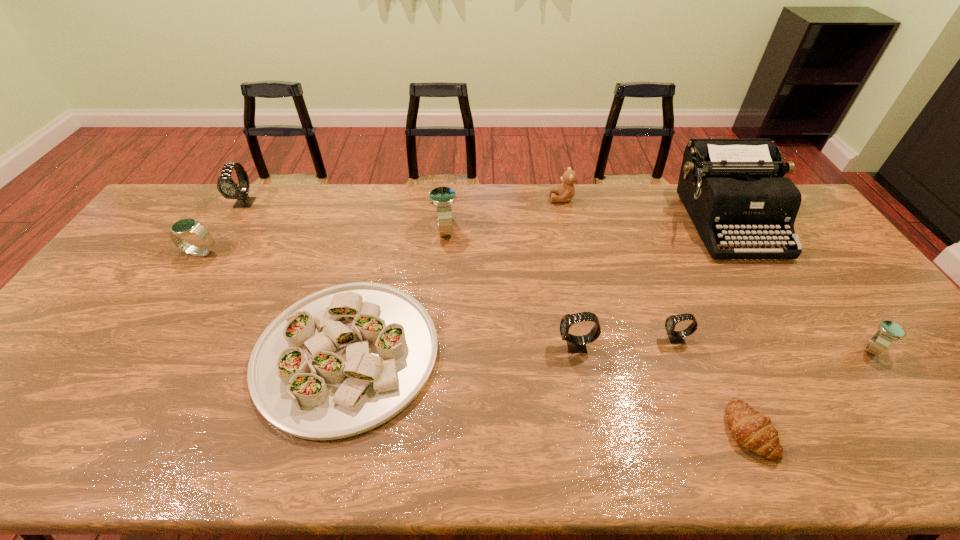
Where is `the smallest gray watch`? the smallest gray watch is located at coordinates [x=675, y=337].

Locate an element on the screen. The width and height of the screenshot is (960, 540). the fifth watch from left to right is located at coordinates (675, 337).

Where is `the rightmost blue watch`? This screenshot has height=540, width=960. the rightmost blue watch is located at coordinates (889, 331).

This screenshot has height=540, width=960. Identify the location of the smallest blue watch. (889, 331).

Locate an element on the screen. platter is located at coordinates (344, 360).

Locate an element on the screen. The height and width of the screenshot is (540, 960). crescent roll is located at coordinates (754, 431).

I want to click on the shortest object, so click(x=754, y=431).

Where is `vacant space located 0.150m on the typing side of the typewriter`? vacant space located 0.150m on the typing side of the typewriter is located at coordinates (773, 299).

Identify the location of free space located 0.270m on the face of the biggest gray watch. This screenshot has width=960, height=540. (205, 268).

This screenshot has width=960, height=540. Find the location of `vacant area situated 0.300m on the left of the farthest blue watch`. vacant area situated 0.300m on the left of the farthest blue watch is located at coordinates click(x=341, y=230).